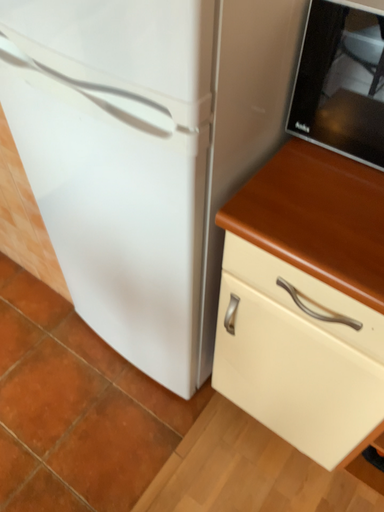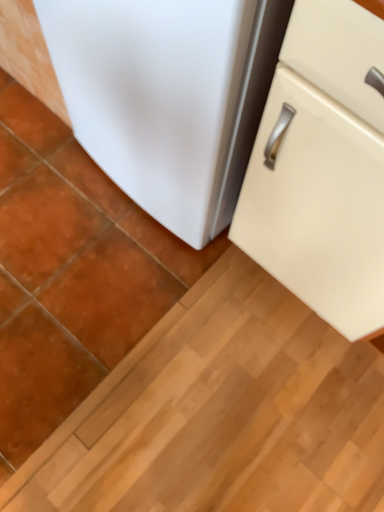
Question: Which way did the camera rotate in the video?

Choices:
 (A) rotated upward
 (B) rotated downward

Answer: (B)